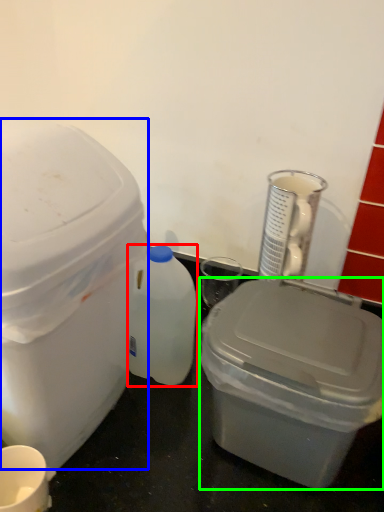
Question: Which is farther away from bottle (highlighted by a red box)? storage box (highlighted by a blue box) or storage box (highlighted by a green box)?

Choices:
 (A) storage box
 (B) storage box

Answer: (B)